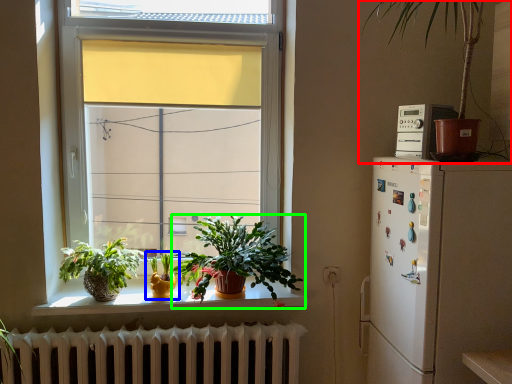
Question: Estimate the real-world distances between objects in this image. Which object is closer to houseplant (highlighted by a red box), houseplant (highlighted by a blue box) or houseplant (highlighted by a green box)?

Choices:
 (A) houseplant
 (B) houseplant

Answer: (B)